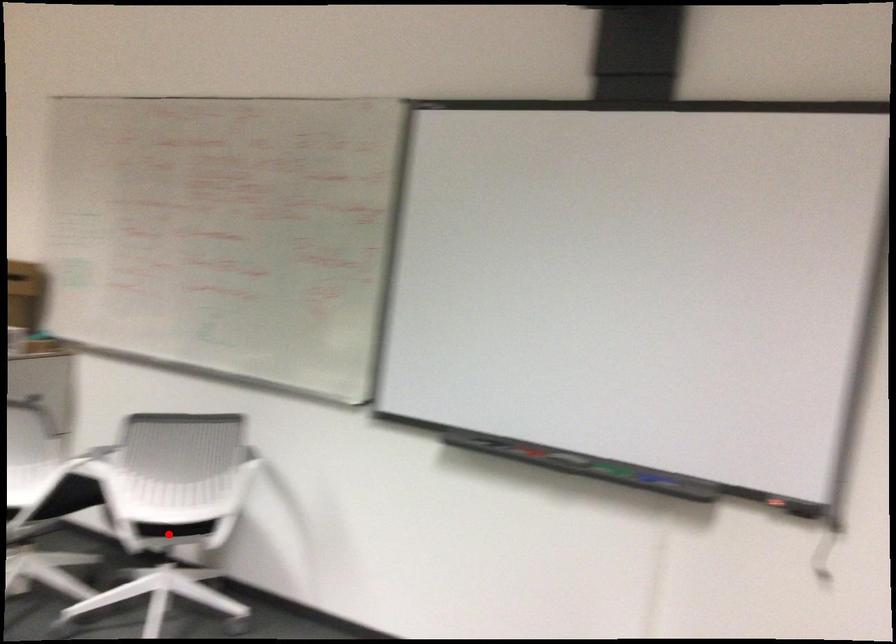
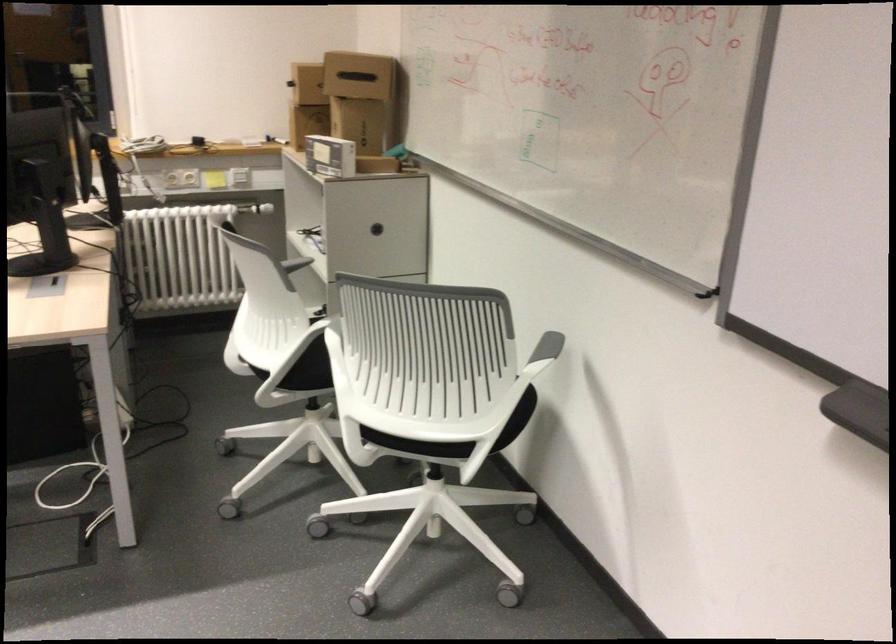
In the second image, find the point that corresponds to the highlighted location in the first image.

(418, 444)